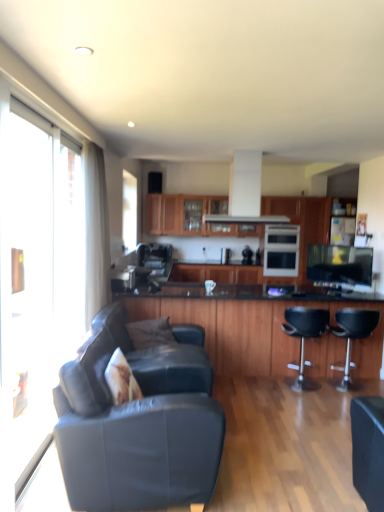
I want to click on blank space to the left of black leather bar stool at center right, acting as the first chair starting from the left, so click(x=258, y=389).